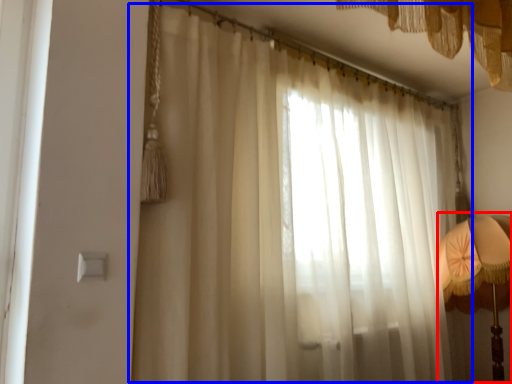
Question: Which object appears farthest to the camera in this image, bedside lamp (highlighted by a red box) or curtain (highlighted by a blue box)?

Choices:
 (A) bedside lamp
 (B) curtain

Answer: (A)